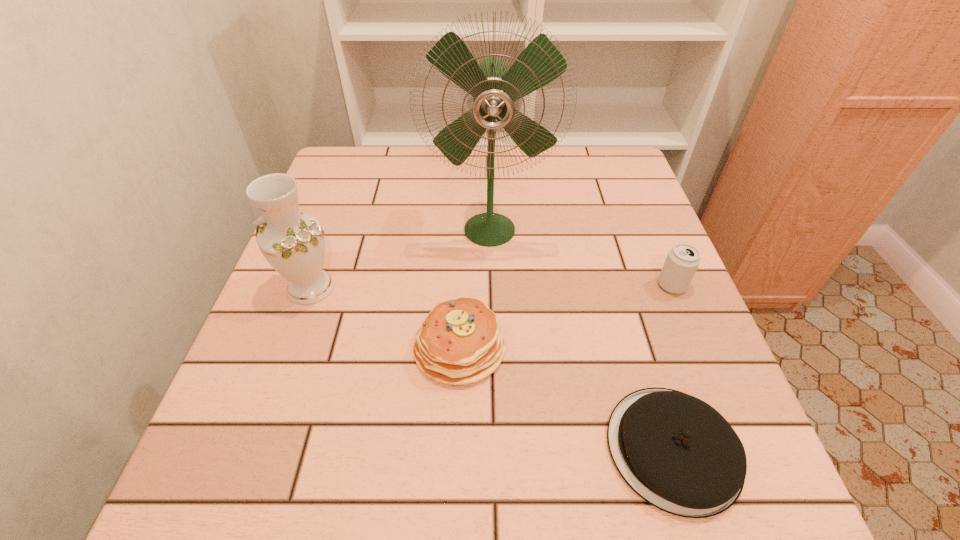
I want to click on free region at the near edge of the desktop, so click(x=512, y=464).

Find the location of `blank space at the left edge of the desktop`. blank space at the left edge of the desktop is located at coordinates (242, 453).

At what (x,y) coordinates should I click in order to perform the action: click on vacant space at the right edge. Please return your answer as a coordinate pair (x, y). The width and height of the screenshot is (960, 540). Looking at the image, I should click on (602, 246).

Locate an element on the screen. free space at the far left corner of the desktop is located at coordinates (322, 177).

Find the location of a particular element. free space at the near left corner is located at coordinates (203, 491).

The width and height of the screenshot is (960, 540). What are the coordinates of `free area in between the farther pancake and the tallest object` in the screenshot? It's located at (474, 288).

Where is `vacant space in between the can and the second shortest object`? This screenshot has width=960, height=540. vacant space in between the can and the second shortest object is located at coordinates [565, 316].

Locate an element on the screen. vacant point located between the can and the fourth farthest object is located at coordinates (565, 316).

I want to click on unoccupied position between the second nearest object and the nearer pancake, so click(566, 398).

This screenshot has width=960, height=540. What are the coordinates of `empty location between the leftmost object and the tallest object` in the screenshot? It's located at (400, 258).